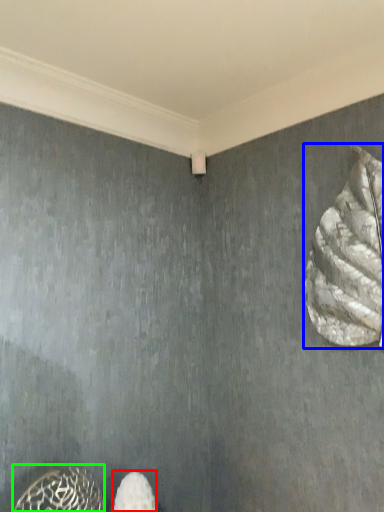
Question: Considering the real-world distances, which object is farthest from footwear (highlighted by a red box)? animal (highlighted by a blue box) or animal (highlighted by a green box)?

Choices:
 (A) animal
 (B) animal

Answer: (A)